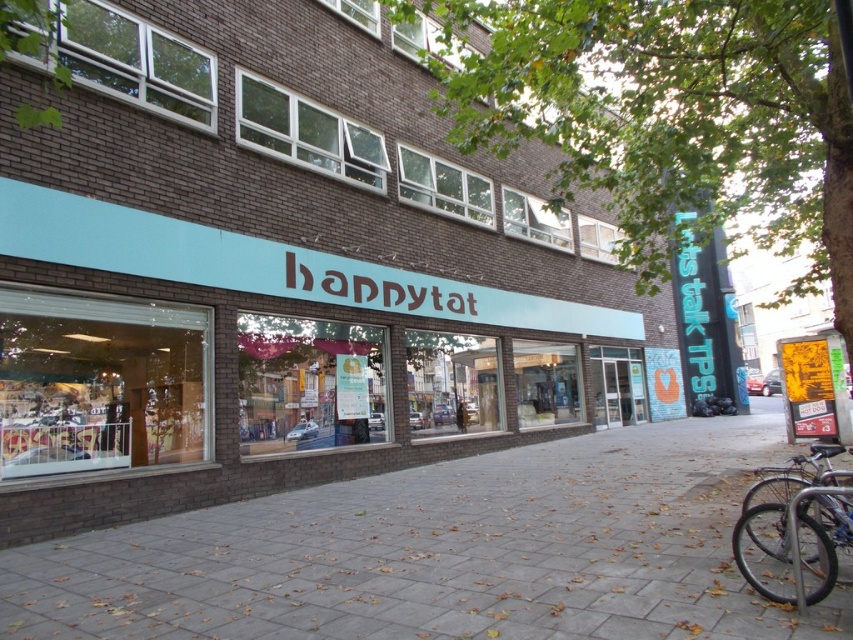
Does gray brick pavement at center have a larger size compared to silver metallic bicycle at lower right?

Yes.

Which is in front, point (715, 458) or point (817, 524)?

Point (817, 524) is in front.

What do you see at coordinates (444, 552) in the screenshot? I see `gray brick pavement at center` at bounding box center [444, 552].

Find the location of a particular element. gray brick pavement at center is located at coordinates (444, 552).

Is matte teal signboard at center thinner than silver metallic bicycle at lower right?

No.

Find the location of `matte teal signboard at center`. matte teal signboard at center is located at coordinates (280, 273).

At what (x,y) coordinates should I click in order to perform the action: click on matte teal signboard at center. Please return your answer as a coordinate pair (x, y). Looking at the image, I should click on (280, 273).

Can you confirm if matte teal signboard at center is positioned above gray brick pavement at center?

Indeed, matte teal signboard at center is positioned over gray brick pavement at center.

Does matte teal signboard at center have a greater height compared to gray brick pavement at center?

Yes.

Describe the element at coordinates (280, 273) in the screenshot. I see `matte teal signboard at center` at that location.

Find the location of a particular element. Image resolution: width=853 pixels, height=640 pixels. matte teal signboard at center is located at coordinates (280, 273).